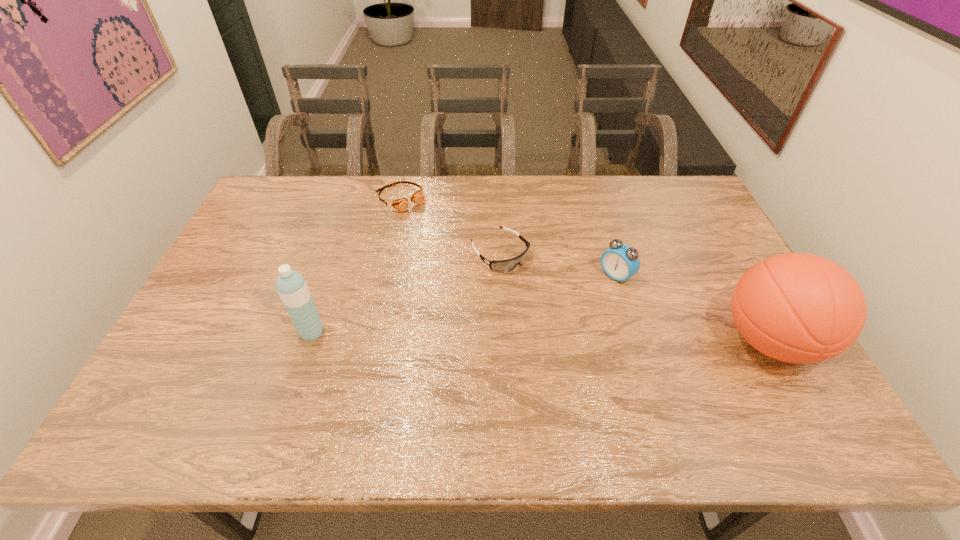
I want to click on vacant region between the rightmost object and the water bottle, so click(x=540, y=336).

This screenshot has width=960, height=540. Identify the location of free space between the leftmost object and the rightmost object. (540, 336).

Locate an element on the screen. Image resolution: width=960 pixels, height=540 pixels. vacant area that lies between the third object from right to left and the alarm clock is located at coordinates (558, 265).

Where is `unoccupied area between the rightmost object and the third object from left to right`? unoccupied area between the rightmost object and the third object from left to right is located at coordinates (635, 297).

Locate an element on the screen. Image resolution: width=960 pixels, height=540 pixels. empty space between the left goggles and the leftmost object is located at coordinates (356, 266).

This screenshot has width=960, height=540. Identify the location of free space that is in between the alarm clock and the third object from left to right. click(558, 265).

The height and width of the screenshot is (540, 960). Find the location of `free space between the farther goggles and the alarm clock`. free space between the farther goggles and the alarm clock is located at coordinates (508, 237).

Locate an element on the screen. Image resolution: width=960 pixels, height=540 pixels. vacant point located between the basketball and the water bottle is located at coordinates (540, 336).

At what (x,y) coordinates should I click in order to perform the action: click on object that is the nearest to the nearer goggles. Please return your answer as a coordinate pair (x, y). The height and width of the screenshot is (540, 960). Looking at the image, I should click on (402, 204).

Identify which object is located as the nearest to the water bottle. Please provide its 2D coordinates. Your answer should be formatted as a tuple, i.e. [(x, y)], where the tuple contains the x and y coordinates of a point satisfying the conditions above.

[(508, 265)]